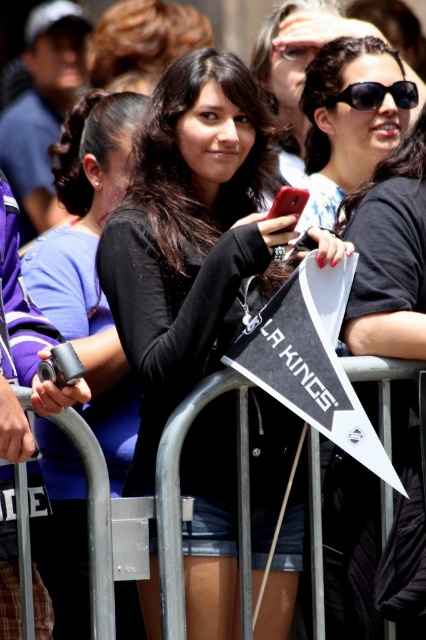
What are the coordinates of the matte black phone at center?

The matte black phone at center is located at coordinates (x=190, y=236).

You are standing in the crowd at this event and want to take a photo of the young woman holding the red smartphone and the black pennant. Which of the two points, point (163, 316) or point (221, 384), is closer to you and would allow for a better closeup shot?

Point (163, 316) is closer to you than point (221, 384), so it would allow for a better closeup shot.